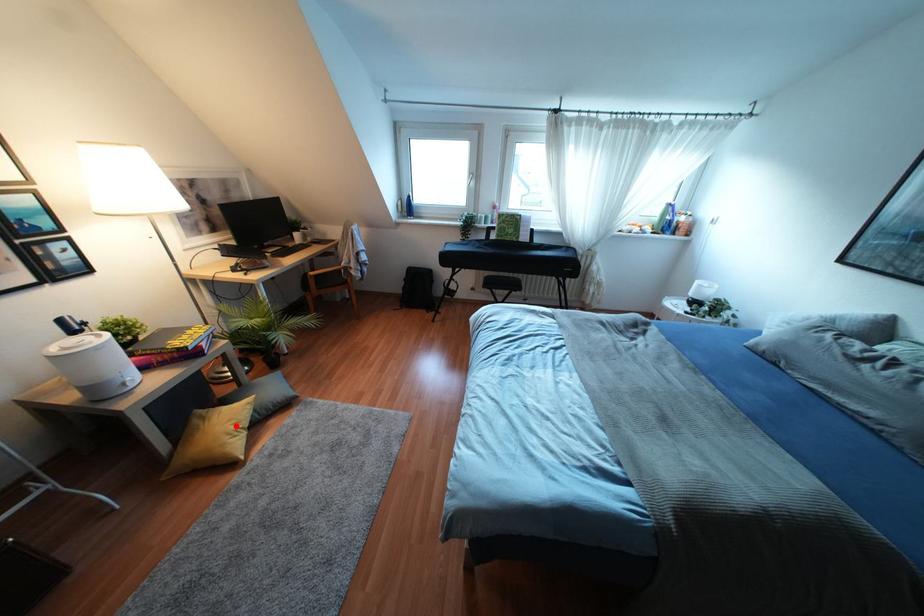
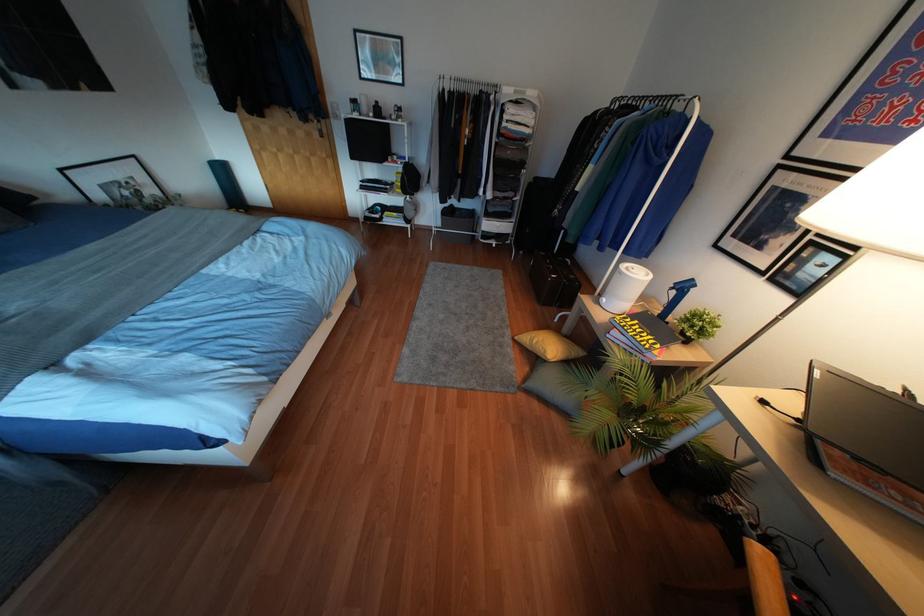
Find the pixel in the second image that matches the highlighted location in the first image.

(533, 341)